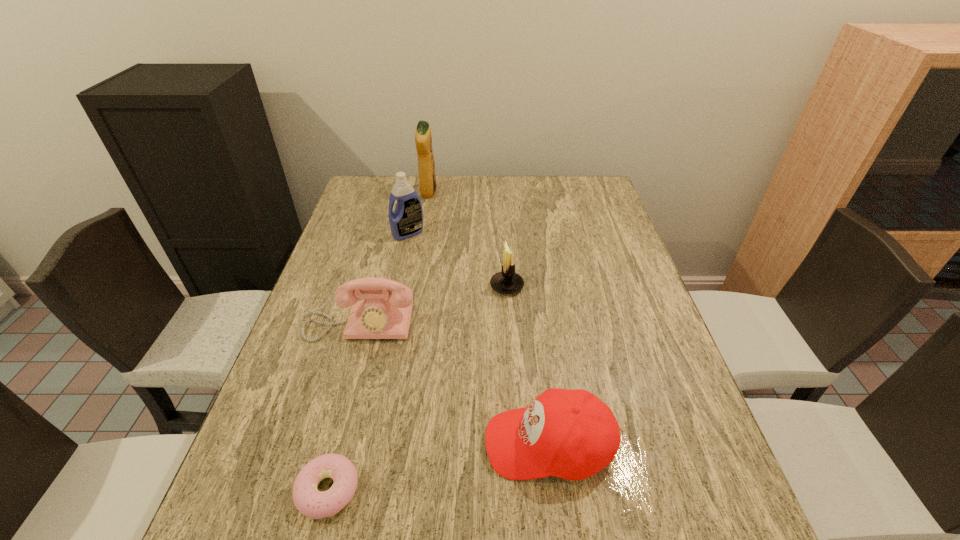
Where is `empty space that is in between the candle holder and the third nearest object`? empty space that is in between the candle holder and the third nearest object is located at coordinates (433, 305).

Find the location of `free space between the shortest object and the third farthest object`. free space between the shortest object and the third farthest object is located at coordinates (418, 388).

Locate an element on the screen. object that can be found as the closest to the shortest object is located at coordinates (571, 434).

Locate an element on the screen. The height and width of the screenshot is (540, 960). object that is the third nearest to the baseball cap is located at coordinates (506, 282).

In order to click on blank area in the image that satisfies the following two spatial constraints: 1. on the back side of the candle holder; 2. on the label of the taller detergent in this screenshot , I will do `click(500, 192)`.

Image resolution: width=960 pixels, height=540 pixels. Identify the location of free space that satisfies the following two spatial constraints: 1. on the label of the tallest object; 2. on the front side of the second farthest object. (421, 233).

Identify the location of vacant space that satisfies the following two spatial constraints: 1. on the label of the fourth nearest object; 2. on the left side of the taller detergent. (413, 286).